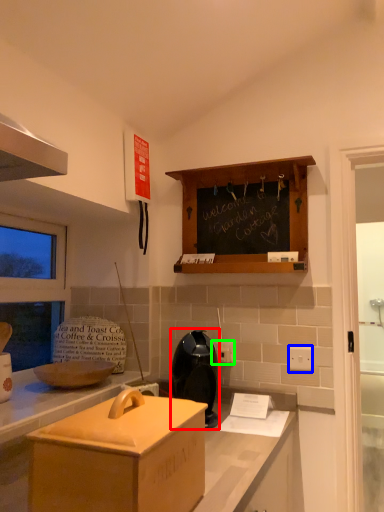
Question: Based on their relative distances, which object is nearer to appliance (highlighted by a red box)? Choose from electric outlet (highlighted by a blue box) and electric outlet (highlighted by a green box).

Choices:
 (A) electric outlet
 (B) electric outlet

Answer: (B)